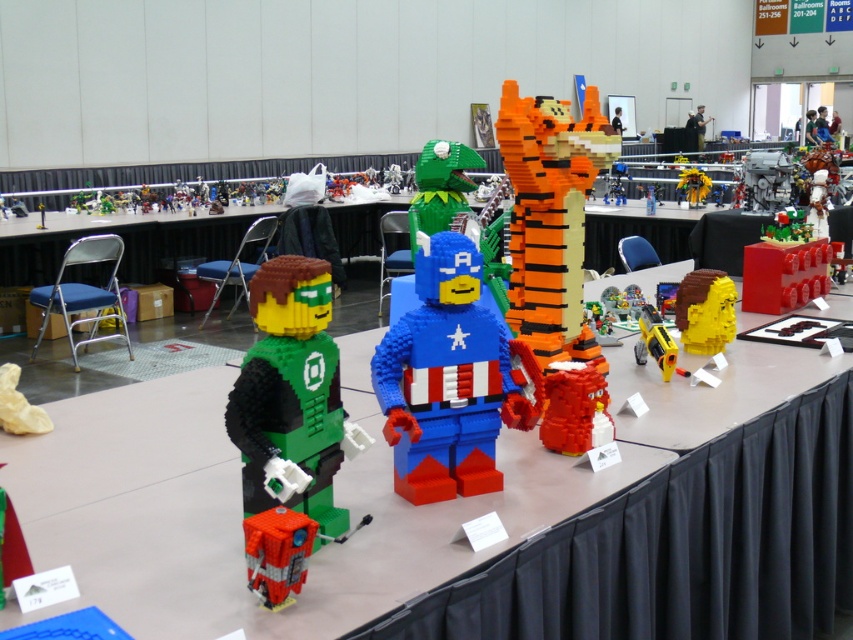
In the scene shown: You are a LEGO enthusiast attending the exhibition and want to take a photo of both the orange striped lego tiger at center and the matte gray engine at center. Which one should you focus on first to ensure both are in the frame without moving the camera?

You should focus on the orange striped lego tiger at center first because it is in front of the matte gray engine at center, so by focusing on the closer object, both will be in focus without needing to adjust the camera position.

You are at a LEGO exhibition and see the orange striped lego tiger at center and the matte gray engine at center. Which one is positioned to the left?

The orange striped lego tiger at center is positioned to the left of the matte gray engine at center.